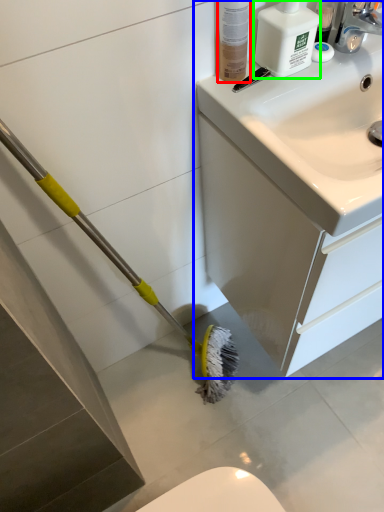
Question: Based on their relative distances, which object is nearer to toiletry (highlighted by a red box)? Choose from bathroom cabinet (highlighted by a blue box) and cleaning product (highlighted by a green box).

Choices:
 (A) bathroom cabinet
 (B) cleaning product

Answer: (B)